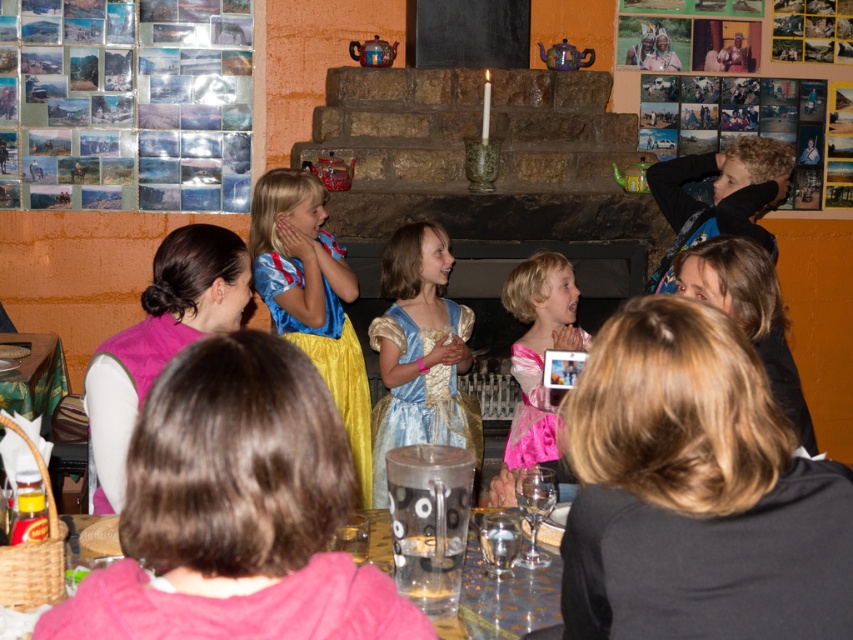
You are a photographer at the event and need to capture both the blue satin dress at center and the pink satin dress at center in a single shot. Which dress should you focus on first to ensure both are in frame?

The blue satin dress at center is below the pink satin dress at center, so you should focus on the pink satin dress at center first to ensure both are in frame.

You are a photographer at the event and want to capture both the blue satin dress at center and the pink satin dress at center in the same frame. Which dress should you position on the left side of the photo to ensure both are visible?

To ensure both the blue satin dress at center and the pink satin dress at center are visible in the same frame, position the blue satin dress at center on the left side since it is already to the left of the pink satin dress at center in the scene.